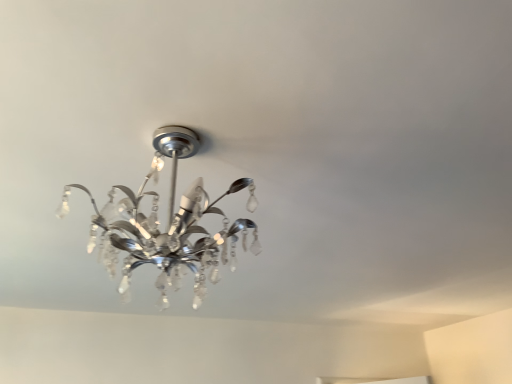
This screenshot has height=384, width=512. What do you see at coordinates (168, 224) in the screenshot?
I see `shiny chrome chandelier at center` at bounding box center [168, 224].

Find the location of a particular element. Image resolution: width=512 pixels, height=384 pixels. shiny chrome chandelier at center is located at coordinates (168, 224).

I want to click on shiny chrome chandelier at center, so click(x=168, y=224).